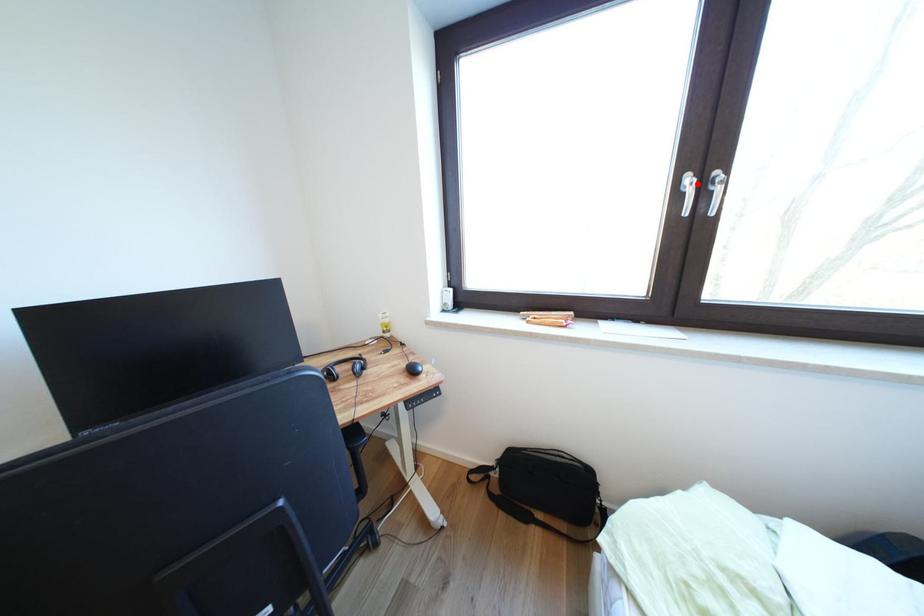
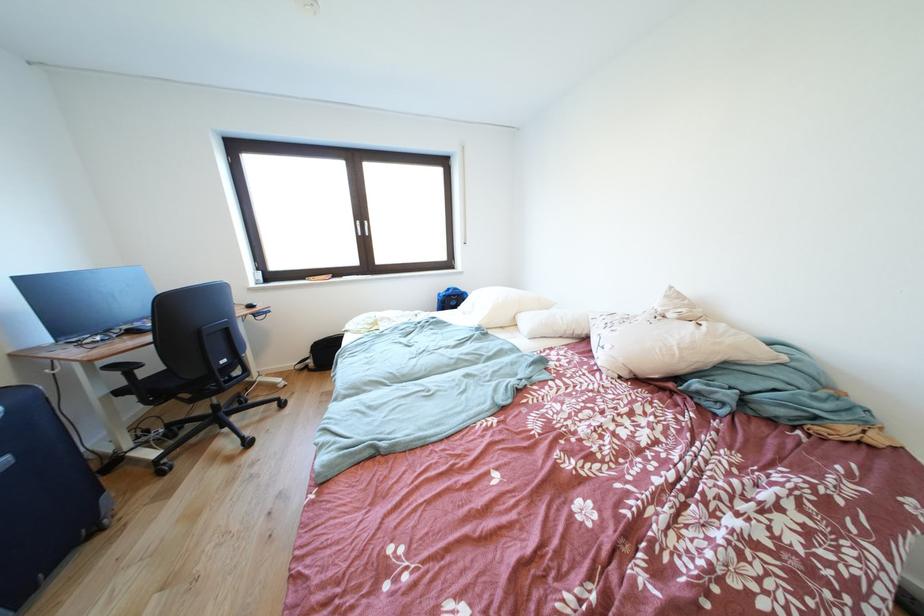
Question: I am providing you with two images of the same scene from different viewpoints. Image1 has a red point marked. In image2, the corresponding 3D location appears at what relative position? Reply with the corresponding letter.

Choices:
 (A) Closer
 (B) Farther

Answer: (A)